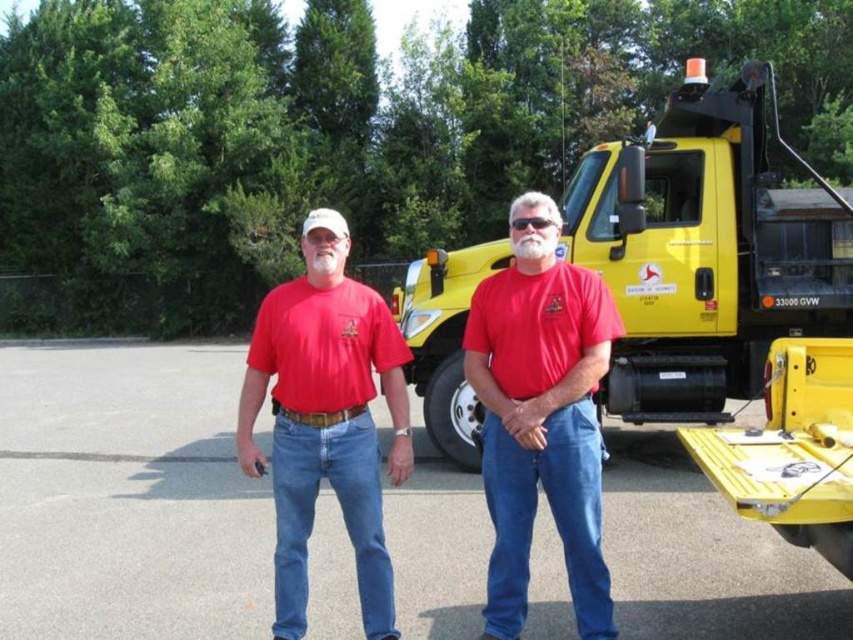
Question: Is red cotton shirt at center thinner than matte red t-shirt at center?

Choices:
 (A) yes
 (B) no

Answer: (A)

Question: Which object is positioned farthest from the matte red shirt at center?

Choices:
 (A) matte red t-shirt at center
 (B) yellow matte tow truck at right

Answer: (B)

Question: Which of the following is the farthest from the observer?

Choices:
 (A) (392, 340)
 (B) (340, 556)
 (C) (520, 228)

Answer: (B)

Question: Does red cotton shirt at center appear on the right side of matte red t-shirt at center?

Choices:
 (A) no
 (B) yes

Answer: (B)

Question: Which point is farther to the camera?

Choices:
 (A) matte red shirt at center
 (B) matte red t-shirt at center
 (C) yellow matte tow truck at right
 (D) gray asphalt parking lot at center

Answer: (C)

Question: Observing the image, what is the correct spatial positioning of gray asphalt parking lot at center in reference to matte red t-shirt at center?

Choices:
 (A) below
 (B) above

Answer: (A)